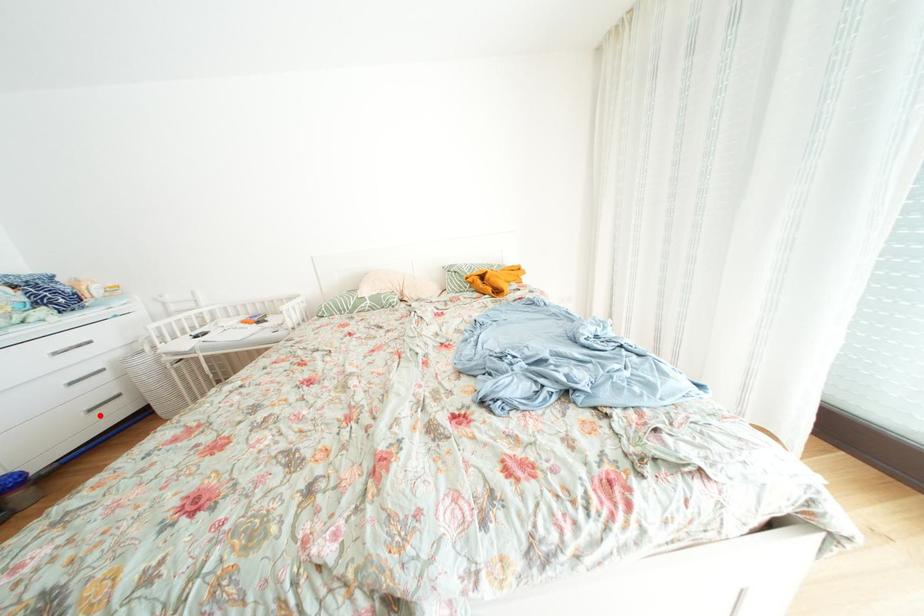
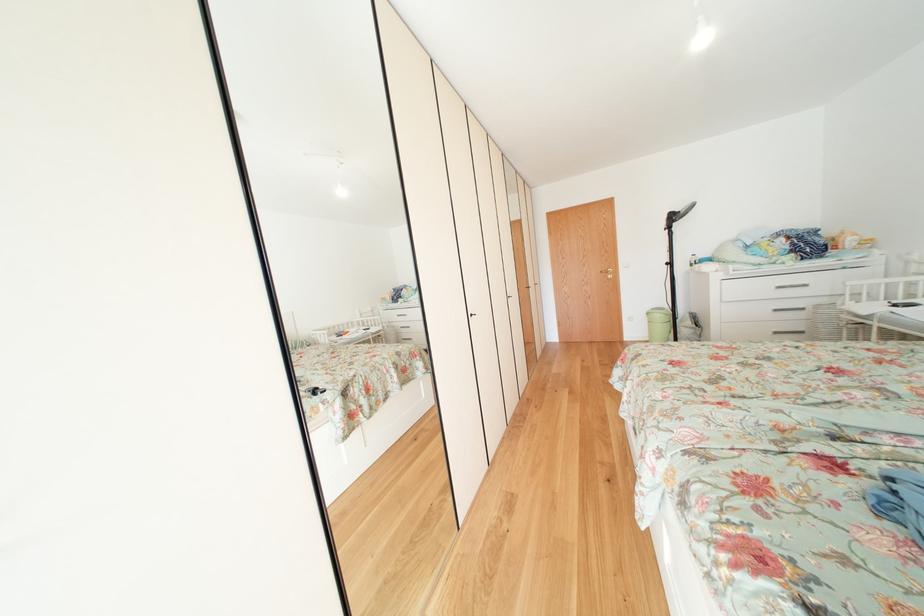
Question: I am providing you with two images of the same scene from different viewpoints. Image1 has a red point marked. In image2, the corresponding 3D location appears at what relative position? Reply with the corresponding letter.

Choices:
 (A) Closer
 (B) Farther

Answer: (A)